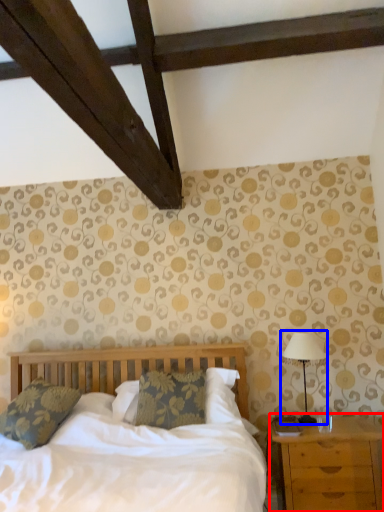
Question: Which object is further to the camera taking this photo, nightstand (highlighted by a red box) or table lamp (highlighted by a blue box)?

Choices:
 (A) nightstand
 (B) table lamp

Answer: (B)